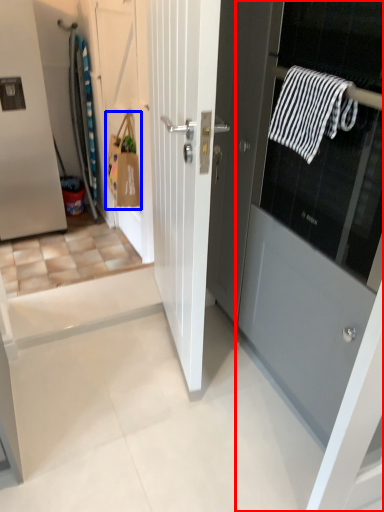
Question: Which point is further to the camera, door (highlighted by a red box) or shopping bag (highlighted by a blue box)?

Choices:
 (A) door
 (B) shopping bag

Answer: (B)